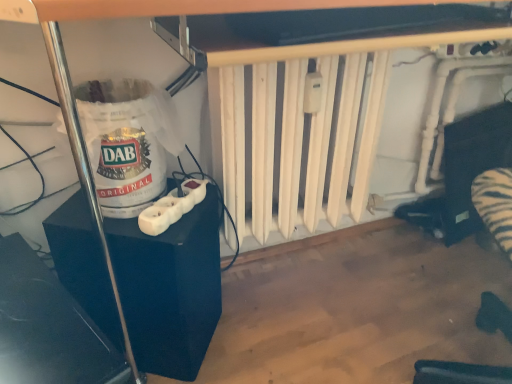
Locate an element on the screen. free location to the right of black plastic power strip at left is located at coordinates click(x=261, y=347).